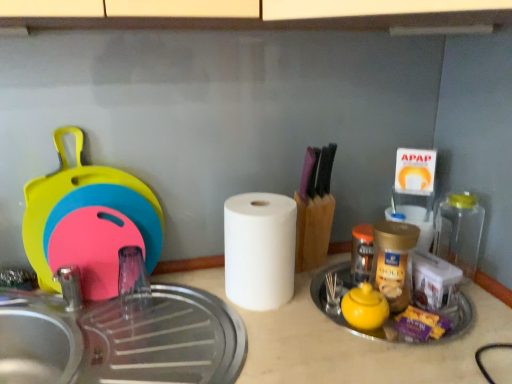
The image size is (512, 384). I want to click on free space to the right of purple plastic candy at lower right, so click(461, 317).